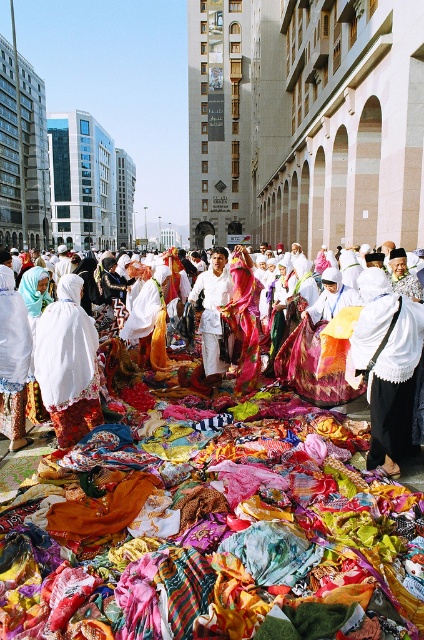
Question: Estimate the real-world distances between objects in this image. Which object is farther from the white cloth at center?

Choices:
 (A) white cotton shirt at center
 (B) white fabric dress at center

Answer: (B)

Question: Does white matte cloth at center have a lesser width compared to white fabric dress at center?

Choices:
 (A) no
 (B) yes

Answer: (B)

Question: Does white matte cloth at center appear over white fabric dress at center?

Choices:
 (A) yes
 (B) no

Answer: (B)

Question: Which of the following is the farthest from the observer?

Choices:
 (A) white cloth at center
 (B) white cotton shirt at center

Answer: (B)

Question: Can you confirm if white cloth at center is positioned to the right of white fabric dress at center?

Choices:
 (A) yes
 (B) no

Answer: (A)

Question: Which is nearer to the white fabric dress at center?

Choices:
 (A) white cotton shirt at center
 (B) white matte cloth at center
 (C) white cloth at center

Answer: (C)